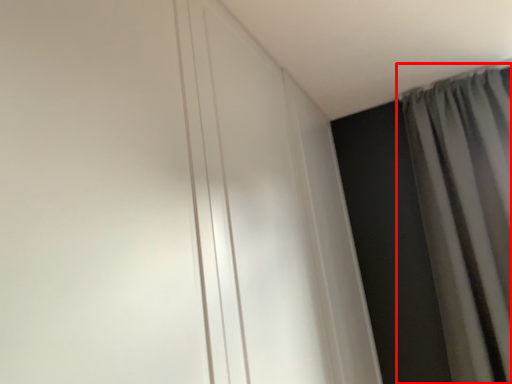
Question: Where is curtain (annotated by the red box) located in relation to door in the image?

Choices:
 (A) right
 (B) left

Answer: (A)